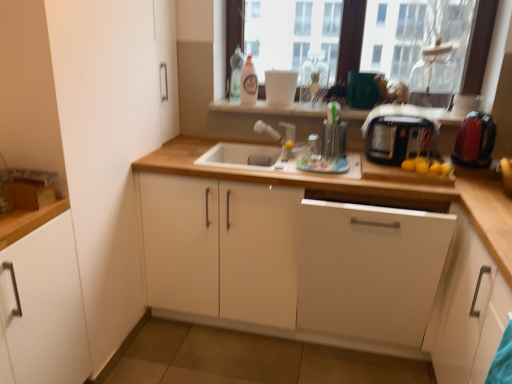
Question: Which direction should I rotate to look at white glossy bottle at upper center, marked as the second bottle in a right-to-left arrangement, — up or down?

Choices:
 (A) up
 (B) down

Answer: (A)

Question: Considering the relative sizes of white matte cabinet at left, which is counted as the 1th cabinetry, starting from the left, and matte white window sill at upper center in the image provided, is white matte cabinet at left, which is counted as the 1th cabinetry, starting from the left, shorter than matte white window sill at upper center?

Choices:
 (A) yes
 (B) no

Answer: (B)

Question: From the image's perspective, is white matte cabinet at left, which is the fifth cabinetry in right-to-left order, located above matte white window sill at upper center?

Choices:
 (A) yes
 (B) no

Answer: (B)

Question: Is white matte cabinet at left, which is counted as the 1th cabinetry, starting from the left, positioned in front of matte white window sill at upper center?

Choices:
 (A) no
 (B) yes

Answer: (B)

Question: Is matte white window sill at upper center at the back of white matte cabinet at left, which is the fifth cabinetry in right-to-left order?

Choices:
 (A) yes
 (B) no

Answer: (B)

Question: Is matte white window sill at upper center a part of white matte cabinet at left, which is counted as the 1th cabinetry, starting from the left?

Choices:
 (A) yes
 (B) no

Answer: (B)

Question: Is white matte cabinet at left, which is the fifth cabinetry in right-to-left order, taller than matte white window sill at upper center?

Choices:
 (A) yes
 (B) no

Answer: (A)

Question: Does matte white window sill at upper center have a lesser height compared to translucent plastic bottle at upper center, the 1th bottle viewed from the left?

Choices:
 (A) no
 (B) yes

Answer: (B)

Question: From the image's perspective, is matte white window sill at upper center located beneath translucent plastic bottle at upper center, the third bottle positioned from the right?

Choices:
 (A) yes
 (B) no

Answer: (A)

Question: Does matte white window sill at upper center have a greater height compared to translucent plastic bottle at upper center, the third bottle positioned from the right?

Choices:
 (A) no
 (B) yes

Answer: (A)

Question: Is matte white window sill at upper center far from translucent plastic bottle at upper center, the third bottle positioned from the right?

Choices:
 (A) yes
 (B) no

Answer: (B)

Question: Is matte white window sill at upper center oriented towards translucent plastic bottle at upper center, the 1th bottle viewed from the left?

Choices:
 (A) yes
 (B) no

Answer: (B)

Question: From a real-world perspective, is matte white window sill at upper center located beneath translucent plastic bottle at upper center, the 1th bottle viewed from the left?

Choices:
 (A) no
 (B) yes

Answer: (B)

Question: Is transparent glass window at upper center thinner than satin nickel faucet at center?

Choices:
 (A) yes
 (B) no

Answer: (A)